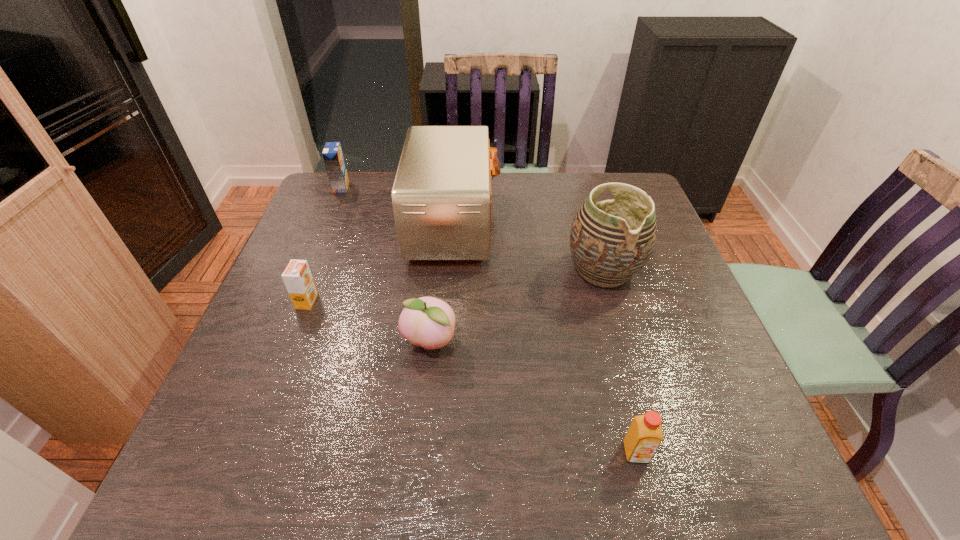
Locate an element on the screen. The width and height of the screenshot is (960, 540). toaster oven is located at coordinates (441, 197).

Locate an element on the screen. The width and height of the screenshot is (960, 540). pottery is located at coordinates (611, 241).

Where is `the farthest orange juice`? the farthest orange juice is located at coordinates click(332, 153).

This screenshot has width=960, height=540. I want to click on the fifth farthest object, so click(429, 322).

The width and height of the screenshot is (960, 540). I want to click on the nearest object, so click(644, 435).

In order to click on the rightmost orange juice in this screenshot , I will do `click(644, 435)`.

What are the coordinates of `the second farthest orange juice` in the screenshot? It's located at (297, 277).

Image resolution: width=960 pixels, height=540 pixels. I want to click on free space located 0.320m on the door side of the toaster oven, so click(610, 225).

Where is `vacant space located 0.330m on the left of the pottery`? vacant space located 0.330m on the left of the pottery is located at coordinates (436, 271).

At what (x,y) coordinates should I click in order to perform the action: click on free location located 0.390m on the front of the farthest orange juice. Please return your answer as a coordinate pair (x, y). Looking at the image, I should click on (302, 281).